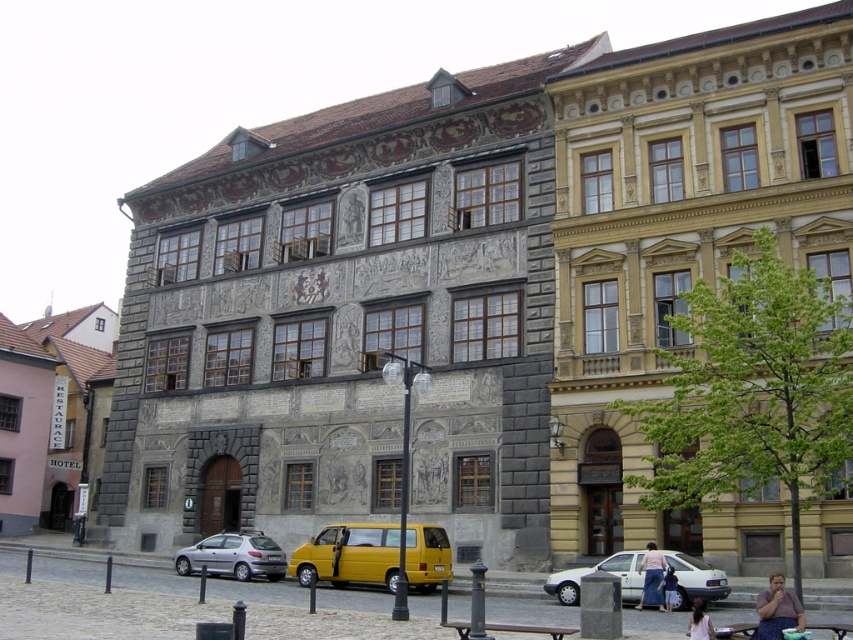
Question: Based on their relative distances, which object is nearer to the light brown hair at lower center?

Choices:
 (A) matte pink shirt at lower right
 (B) denim skirt at lower right
 (C) yellow matte van at center

Answer: (A)

Question: Among these points, which one is farthest from the camera?

Choices:
 (A) (694, 621)
 (B) (242, 541)
 (C) (724, 584)
 (D) (430, 529)

Answer: (B)

Question: Considering the relative positions of white matte sedan at lower center and light brown hair at lower center in the image provided, where is white matte sedan at lower center located with respect to light brown hair at lower center?

Choices:
 (A) right
 (B) left

Answer: (B)

Question: Which point is farther from the camera taking this photo?

Choices:
 (A) (756, 609)
 (B) (664, 604)

Answer: (A)

Question: Can you confirm if matte pink shirt at lower right is positioned above light brown leather jacket at lower center?

Choices:
 (A) no
 (B) yes

Answer: (B)

Question: Does matte pink shirt at lower right have a larger size compared to light brown leather jacket at lower center?

Choices:
 (A) no
 (B) yes

Answer: (B)